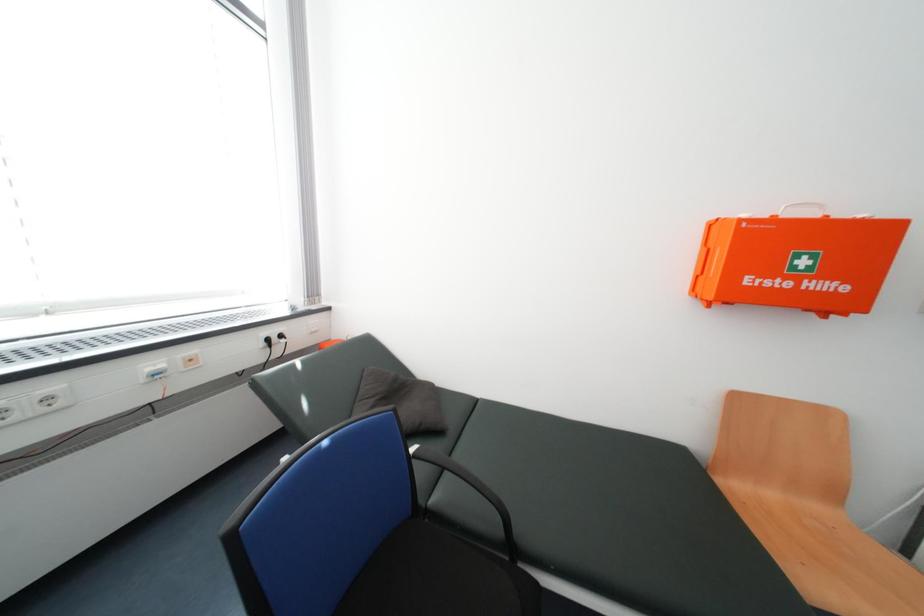
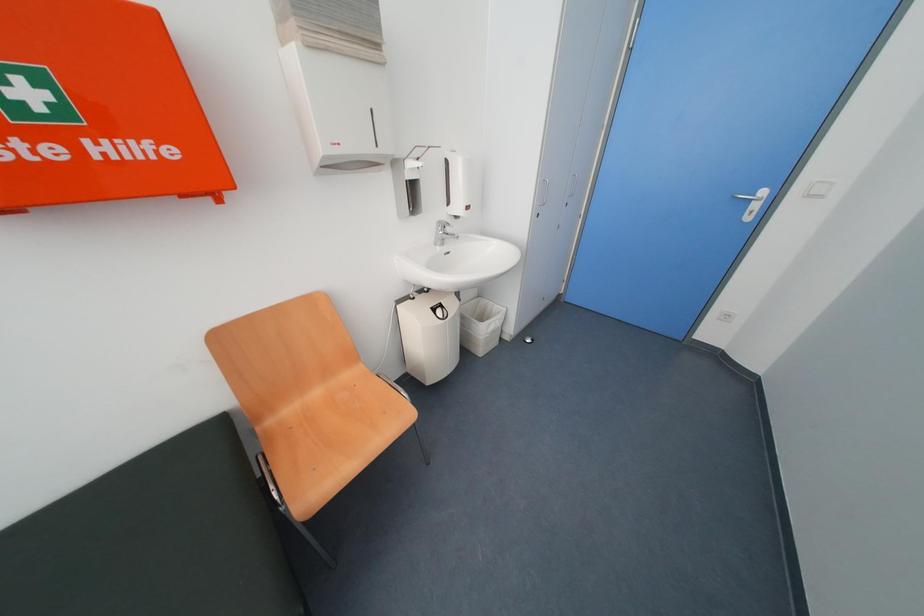
Based on the continuous images, in which direction is the camera rotating?

The rotation direction of the camera is right-down.